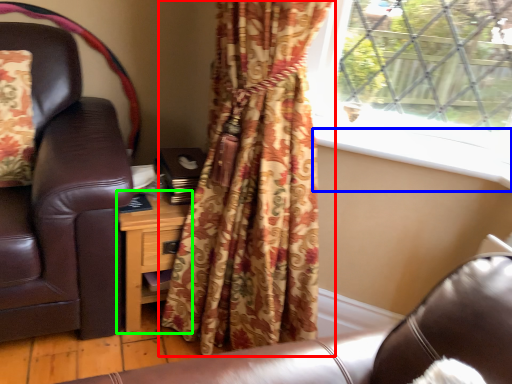
Question: Which object is positioned closest to curtain (highlighted by a red box)? Select from window sill (highlighted by a blue box) and nightstand (highlighted by a green box).

Choices:
 (A) window sill
 (B) nightstand

Answer: (B)